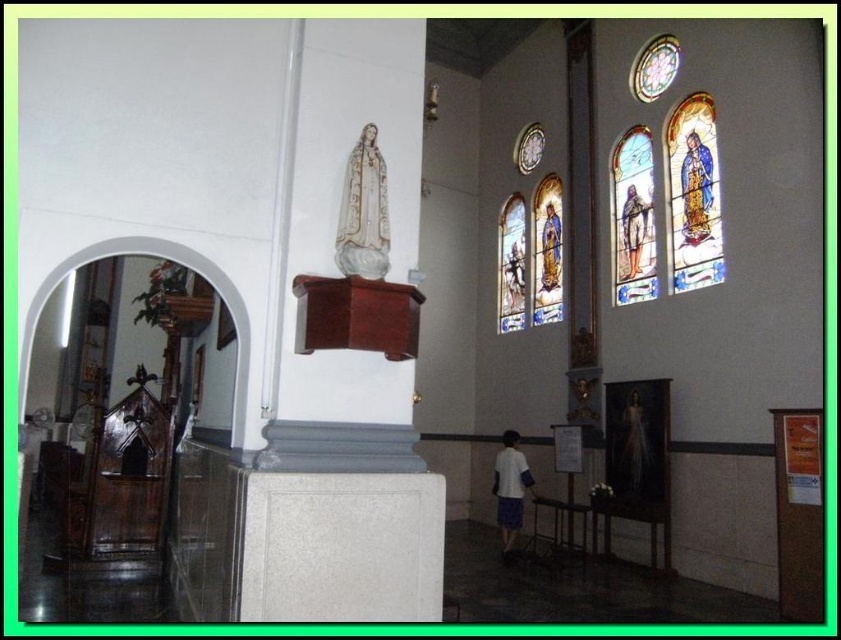
You are standing at the entrance of the church and want to take a photo of the white glossy statue at upper center. The camera you are using has a maximum focus range of 14 feet. Will the statue be in focus?

The white glossy statue at upper center is 13.83 feet from camera, which is within the camera maximum focus range of 14 feet. Therefore, the statue will be in focus.

Based on the photo, you are an art student observing the church interior. You notice the white glossy statue at upper center and the translucent ethereal figure at center. Which object is positioned to the left of the other?

The white glossy statue at upper center is to the left of the translucent ethereal figure at center.

You are an interior designer planning to place a new artwork between the white glossy statue at upper center and the blue fabric figure at upper right. Given their sizes, which object should you consider moving to accommodate the new artwork?

The white glossy statue at upper center is smaller than the blue fabric figure at upper right. To accommodate the new artwork, you should consider moving the larger object, the blue fabric figure at upper right, since it occupies more space.